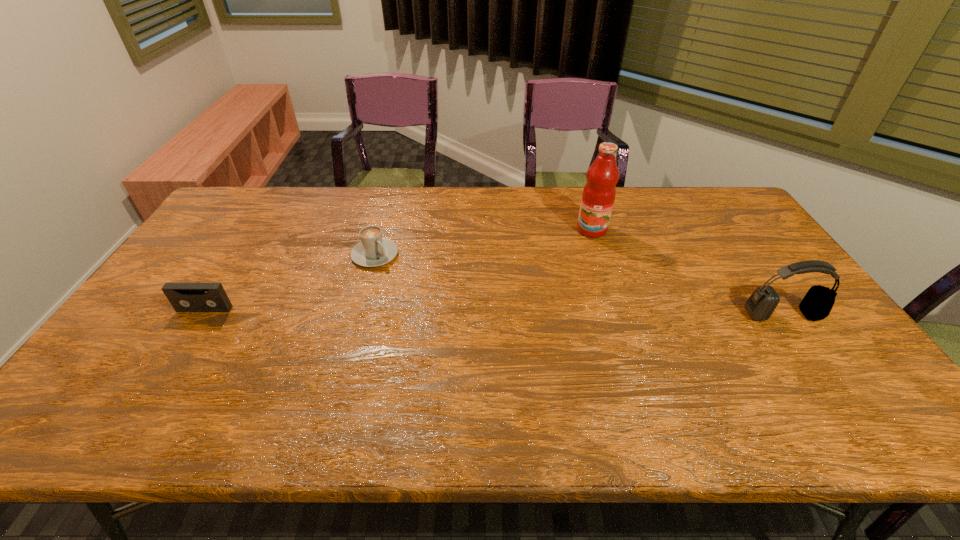
This screenshot has height=540, width=960. Identify the location of videotape. (184, 297).

At what (x,y) coordinates should I click in order to perform the action: click on headset. Please return your answer as a coordinate pair (x, y). The height and width of the screenshot is (540, 960). Looking at the image, I should click on (816, 305).

Image resolution: width=960 pixels, height=540 pixels. Identify the location of the second tallest object. pyautogui.click(x=816, y=305).

In order to click on fruit juice in this screenshot , I will do `click(598, 196)`.

This screenshot has width=960, height=540. I want to click on the farthest object, so click(598, 196).

The height and width of the screenshot is (540, 960). I want to click on the third object from right to left, so click(373, 250).

You are a GUI agent. You are given a task and a screenshot of the screen. Output one action in this format:
    pyautogui.click(x=<x>, y=<y>)
    Task: Click on the second farthest object
    
    Given the screenshot: What is the action you would take?
    pyautogui.click(x=373, y=250)

This screenshot has width=960, height=540. Find the location of `free space located 0.230m on the front-facing side of the videotape`. free space located 0.230m on the front-facing side of the videotape is located at coordinates (156, 384).

At what (x,y) coordinates should I click in order to perform the action: click on free space located on the headband of the third shortest object. Please return your answer as a coordinate pair (x, y). This screenshot has width=960, height=540. Looking at the image, I should click on (806, 349).

The height and width of the screenshot is (540, 960). In order to click on vacant area located 0.270m on the front label of the third object from left to right in this screenshot , I will do pos(579,293).